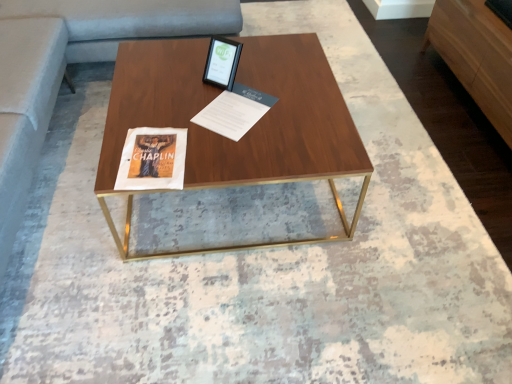
Image resolution: width=512 pixels, height=384 pixels. Find the location of `vacant area that is in front of white paper at center`. vacant area that is in front of white paper at center is located at coordinates (231, 150).